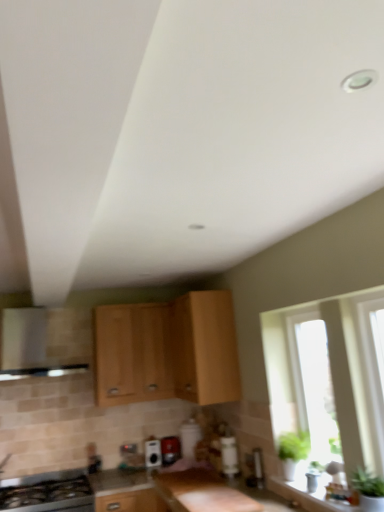
What do you see at coordinates (119, 481) in the screenshot? I see `smooth granite countertop at center` at bounding box center [119, 481].

Image resolution: width=384 pixels, height=512 pixels. What do you see at coordinates (44, 341) in the screenshot?
I see `satin silver vent at left` at bounding box center [44, 341].

How much space does satin black toaster at center, positioned as the 2th appliance in right-to-left order, occupy horizontally?

The width of satin black toaster at center, positioned as the 2th appliance in right-to-left order, is 13.90 centimeters.

You are a GUI agent. You are given a task and a screenshot of the screen. Output one action in this format:
    pyautogui.click(x=<x>, y=<y>)
    Task: Click on the satin black toaster at center, the first appliance when ordered from left to right
    The image size is (384, 512).
    Given the screenshot: What is the action you would take?
    pyautogui.click(x=153, y=453)

Describe the element at coordinates (170, 450) in the screenshot. I see `metallic silver toaster at center, acting as the 2th appliance starting from the left` at that location.

The height and width of the screenshot is (512, 384). What do you see at coordinates (167, 350) in the screenshot? I see `light wood cabinet at center, the second cabinetry viewed from the left` at bounding box center [167, 350].

What is the approximate height of black glass stove at lower left?

The height of black glass stove at lower left is 24.13 centimeters.

At what (x,y) coordinates should I click in order to perform the action: click on transparent glass window at right. Please return your answer as a coordinate pair (x, y). The width and height of the screenshot is (384, 512). Looking at the image, I should click on (329, 376).

Considering the relative positions of light wood cabinet at center, which is the third cabinetry from left to right, and smooth granite countertop at center in the image provided, is light wood cabinet at center, which is the third cabinetry from left to right, to the right of smooth granite countertop at center from the viewer's perspective?

Indeed, light wood cabinet at center, which is the third cabinetry from left to right, is positioned on the right side of smooth granite countertop at center.

Can you tell me how much light wood cabinet at center, which is the third cabinetry from left to right, and smooth granite countertop at center differ in facing direction?

light wood cabinet at center, which is the third cabinetry from left to right, and smooth granite countertop at center are facing 0.0562 degrees away from each other.

Considering their positions, is light wood cabinet at center, which is the third cabinetry from left to right, located in front of or behind smooth granite countertop at center?

Clearly, light wood cabinet at center, which is the third cabinetry from left to right, is behind smooth granite countertop at center.

Does point (177, 371) come in front of point (117, 483)?

No.

Would you consider satin silver vent at left to be distant from smooth granite countertop at center?

satin silver vent at left is positioned a significant distance from smooth granite countertop at center.

Is smooth granite countertop at center a part of satin silver vent at left?

No, smooth granite countertop at center is not surrounded by satin silver vent at left.

Considering the points (58, 364) and (100, 472), which point is in front, point (58, 364) or point (100, 472)?

Point (58, 364)

Looking at this image, which object is further away from the camera taking this photo, satin silver vent at left or smooth granite countertop at center?

Positioned behind is satin silver vent at left.

Which object is positioned more to the left, metallic silver toaster at center, acting as the 2th appliance starting from the left, or satin silver vent at left?

Positioned to the left is satin silver vent at left.

Is metallic silver toaster at center, which ranks as the first appliance in right-to-left order, further to the viewer compared to satin silver vent at left?

Yes, the depth of metallic silver toaster at center, which ranks as the first appliance in right-to-left order, is greater than that of satin silver vent at left.

Is metallic silver toaster at center, which ranks as the first appliance in right-to-left order, looking in the opposite direction of satin silver vent at left?

No, satin silver vent at left is not at the back of metallic silver toaster at center, which ranks as the first appliance in right-to-left order.

Which of these two, metallic silver toaster at center, acting as the 2th appliance starting from the left, or satin silver vent at left, is smaller?

With smaller size is metallic silver toaster at center, acting as the 2th appliance starting from the left.

Looking at this image, is black glass stove at lower left facing towards satin silver vent at left?

No.

Are black glass stove at lower left and satin silver vent at left located far from each other?

black glass stove at lower left is near satin silver vent at left, not far away.

Where is `kitchen appliance on the right of satin silver vent at left`? The width and height of the screenshot is (384, 512). kitchen appliance on the right of satin silver vent at left is located at coordinates (49, 496).

Which point is more distant from viewer, (65,495) or (20,317)?

The point (20,317) is farther.

Who is smaller, metallic silver toaster at center, acting as the 2th appliance starting from the left, or transparent glass window at right?

metallic silver toaster at center, acting as the 2th appliance starting from the left.

From the image's perspective, does metallic silver toaster at center, acting as the 2th appliance starting from the left, appear higher than transparent glass window at right?

No, from the image's perspective, metallic silver toaster at center, acting as the 2th appliance starting from the left, is not over transparent glass window at right.

Visually, is metallic silver toaster at center, acting as the 2th appliance starting from the left, positioned to the left or to the right of transparent glass window at right?

Clearly, metallic silver toaster at center, acting as the 2th appliance starting from the left, is on the left of transparent glass window at right in the image.

Is metallic silver toaster at center, which ranks as the first appliance in right-to-left order, taller than transparent glass window at right?

No, metallic silver toaster at center, which ranks as the first appliance in right-to-left order, is not taller than transparent glass window at right.

Is transparent glass window at right taller than black glass stove at lower left?

Yes.

Is point (377, 430) positioned after point (38, 498)?

No, it is not.

Considering the positions of objects transparent glass window at right and black glass stove at lower left in the image provided, who is more to the right, transparent glass window at right or black glass stove at lower left?

Positioned to the right is transparent glass window at right.

What's the angular difference between transparent glass window at right and light wood cabinet at center, which ranks as the third cabinetry in right-to-left order,'s facing directions?

The angle between the facing direction of transparent glass window at right and the facing direction of light wood cabinet at center, which ranks as the third cabinetry in right-to-left order, is 90.1 degrees.

From a real-world perspective, is transparent glass window at right positioned over light wood cabinet at center, which ranks as the third cabinetry in right-to-left order, based on gravity?

No, from a real-world perspective, transparent glass window at right is not above light wood cabinet at center, which ranks as the third cabinetry in right-to-left order.

Considering the relative positions of transparent glass window at right and light wood cabinet at center, which ranks as the third cabinetry in right-to-left order, in the image provided, is transparent glass window at right to the left or to the right of light wood cabinet at center, which ranks as the third cabinetry in right-to-left order,?

Based on their positions, transparent glass window at right is located to the right of light wood cabinet at center, which ranks as the third cabinetry in right-to-left order.

Between transparent glass window at right and light wood cabinet at center, acting as the 1th cabinetry starting from the left, which one has smaller size?

transparent glass window at right is smaller.

Identify the location of counter top on the left of light wood cabinet at center, which is the third cabinetry from left to right. (119, 481).

Locate an element on the screen. Image resolution: width=384 pixels, height=512 pixels. vent that appears behind the smooth granite countertop at center is located at coordinates (44, 341).

When comparing their distances from metallic silver toaster at center, acting as the 2th appliance starting from the left, does smooth granite countertop at center or black glass stove at lower left seem closer?

Based on the image, smooth granite countertop at center appears to be nearer to metallic silver toaster at center, acting as the 2th appliance starting from the left.

Which object lies nearer to the anchor point metallic silver toaster at center, which ranks as the first appliance in right-to-left order, transparent glass window at right or smooth granite countertop at center?

smooth granite countertop at center lies closer to metallic silver toaster at center, which ranks as the first appliance in right-to-left order, than the other object.

Which object lies further to the anchor point light wood cabinet at center, acting as the 1th cabinetry starting from the left, satin black toaster at center, the first appliance when ordered from left to right, or black glass stove at lower left?

The object further to light wood cabinet at center, acting as the 1th cabinetry starting from the left, is black glass stove at lower left.

From the image, which object appears to be farther from satin silver vent at left, transparent glass window at right or metallic silver toaster at center, which ranks as the first appliance in right-to-left order?

transparent glass window at right is positioned further to the anchor satin silver vent at left.

In the scene shown: Considering their positions, is satin black toaster at center, positioned as the 2th appliance in right-to-left order, positioned further to satin silver vent at left than light wood cabinet at center, which ranks as the third cabinetry in right-to-left order?

satin black toaster at center, positioned as the 2th appliance in right-to-left order.

Looking at the image, which one is located further to transparent glass window at right, black glass stove at lower left or light wood cabinet at center, the second cabinetry viewed from the left?

Based on the image, black glass stove at lower left appears to be further to transparent glass window at right.

From the image, which object appears to be farther from satin silver vent at left, light wood cabinet at center, the 2th cabinetry from the right, or metallic silver toaster at center, acting as the 2th appliance starting from the left?

metallic silver toaster at center, acting as the 2th appliance starting from the left, is further to satin silver vent at left.

Considering their positions, is satin silver vent at left positioned further to satin black toaster at center, the first appliance when ordered from left to right, than light wood cabinet at center, the 2th cabinetry from the right?

satin silver vent at left is further to satin black toaster at center, the first appliance when ordered from left to right.

Identify the location of kitchen appliance between light wood cabinet at center, the second cabinetry viewed from the left, and smooth granite countertop at center in the up-down direction. Image resolution: width=384 pixels, height=512 pixels. click(49, 496).

Where is `cabinetry between light wood cabinet at center, the second cabinetry viewed from the left, and metallic silver toaster at center, acting as the 2th appliance starting from the left, from top to bottom`? This screenshot has width=384, height=512. cabinetry between light wood cabinet at center, the second cabinetry viewed from the left, and metallic silver toaster at center, acting as the 2th appliance starting from the left, from top to bottom is located at coordinates (132, 353).

I want to click on window between light wood cabinet at center, marked as the first cabinetry in a right-to-left arrangement, and smooth granite countertop at center from top to bottom, so click(x=329, y=376).

The image size is (384, 512). I want to click on counter top between satin silver vent at left and transparent glass window at right from left to right, so click(x=119, y=481).